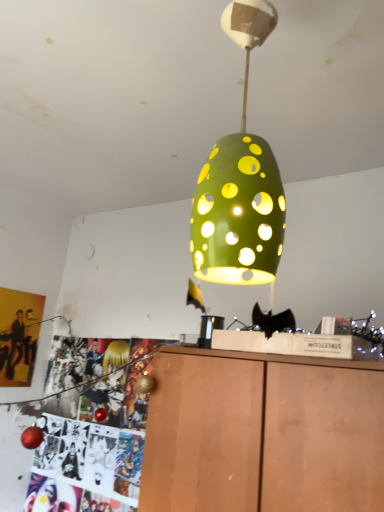
Question: Would you say wooden cabinet at lower center contains green matte/porcelain lamp at center?

Choices:
 (A) no
 (B) yes

Answer: (A)

Question: Is wooden cabinet at lower center further to camera compared to green matte/porcelain lamp at center?

Choices:
 (A) yes
 (B) no

Answer: (A)

Question: Is wooden cabinet at lower center positioned with its back to green matte/porcelain lamp at center?

Choices:
 (A) yes
 (B) no

Answer: (B)

Question: Is wooden cabinet at lower center wider than green matte/porcelain lamp at center?

Choices:
 (A) no
 (B) yes

Answer: (B)

Question: Is wooden cabinet at lower center not within green matte/porcelain lamp at center?

Choices:
 (A) yes
 (B) no

Answer: (A)

Question: From a real-world perspective, does wooden cabinet at lower center stand above green matte/porcelain lamp at center?

Choices:
 (A) no
 (B) yes

Answer: (A)

Question: From the image's perspective, is green matte/porcelain lamp at center located above wooden cabinet at lower center?

Choices:
 (A) yes
 (B) no

Answer: (A)

Question: Is green matte/porcelain lamp at center taller than wooden cabinet at lower center?

Choices:
 (A) no
 (B) yes

Answer: (B)

Question: From the image's perspective, is green matte/porcelain lamp at center beneath wooden cabinet at lower center?

Choices:
 (A) yes
 (B) no

Answer: (B)

Question: Considering the relative sizes of green matte/porcelain lamp at center and wooden cabinet at lower center in the image provided, is green matte/porcelain lamp at center thinner than wooden cabinet at lower center?

Choices:
 (A) no
 (B) yes

Answer: (B)

Question: From a real-world perspective, is green matte/porcelain lamp at center under wooden cabinet at lower center?

Choices:
 (A) no
 (B) yes

Answer: (A)

Question: Considering the relative positions of green matte/porcelain lamp at center and wooden cabinet at lower center in the image provided, is green matte/porcelain lamp at center to the left of wooden cabinet at lower center from the viewer's perspective?

Choices:
 (A) no
 (B) yes

Answer: (B)

Question: Does matte yellow poster at left have a smaller size compared to wooden cabinet at lower center?

Choices:
 (A) yes
 (B) no

Answer: (A)